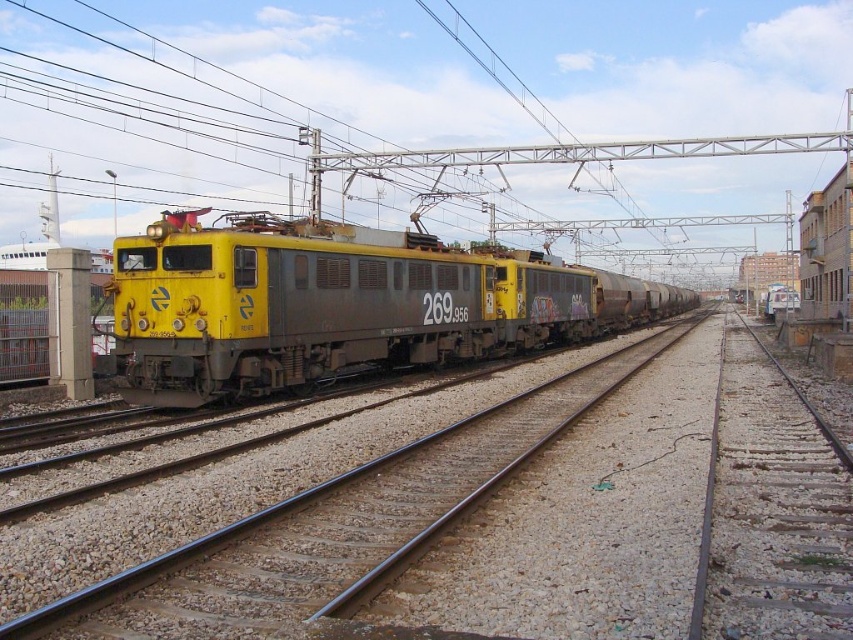
You are standing at the point marked as point (526, 516) in the image. Looking towards the yellow and gray electric locomotive numbered 269 956, which direction should you move to get closer to it?

The yellow and gray electric locomotive numbered 269 956 is located at the front of the image, while the point (526, 516) is at the center. To move closer to the locomotive, you should move towards the front of the image, which is likely the direction opposite to where the freight cars are located.

You are standing in the railway yard and want to determine the relative positions of two points marked in the image. Which point is closer to you, point [689,419] or point [164,218]?

Point [689,419] is closer to the viewer than point [164,218].